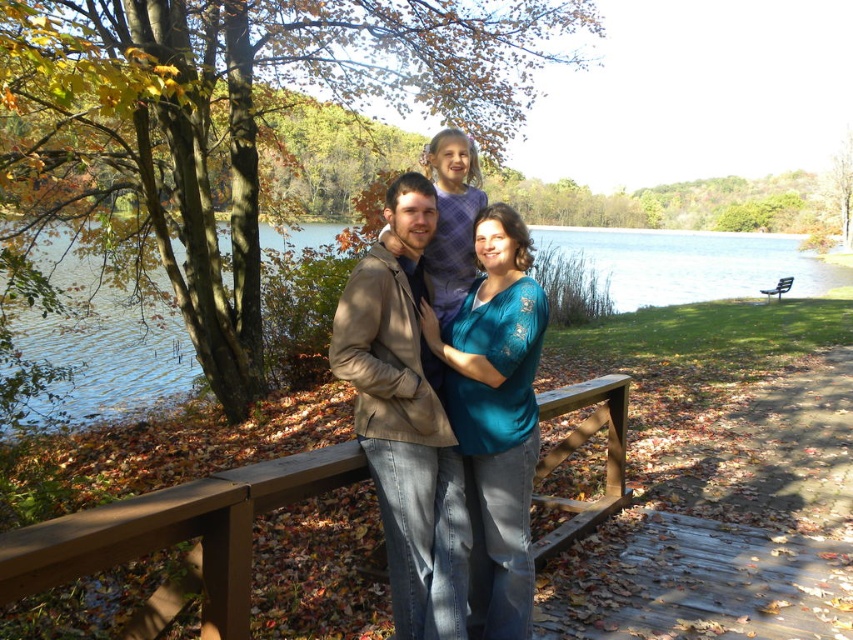
You are a photographer trying to capture a photo of the family. You want to ensure that the tan leather jacket at center and the brown wooden rail at center are both visible in the frame. Based on their positions, which object should you focus on first to ensure both are in the shot?

The brown wooden rail at center is below the tan leather jacket at center, so you should focus on the tan leather jacket at center first to ensure both are in the shot.

You are a photographer trying to capture a clear shot of the tan leather jacket at center without the brown wooden rail at center blocking it. Based on the scene, what adjustment should you make to your camera position?

The tan leather jacket at center is behind the brown wooden rail at center, so to avoid the rail blocking the jacket, you should move your camera position forward to get closer to the rail and jacket, ensuring the jacket is in front of the rail in the frame.

You are a photographer standing near the brown wooden rail at center and the metallic silver bench at lower right. You want to take a photo of the family. Which object is closer to you so that you can focus on it first?

The brown wooden rail at center is closer to the viewer than the metallic silver bench at lower right, so you can focus on the brown wooden rail at center first.